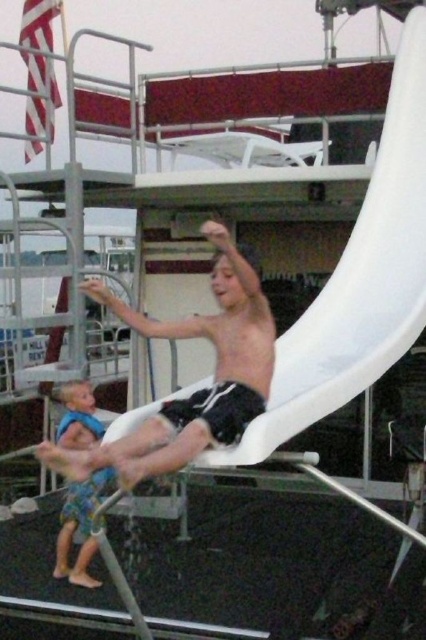
Question: Estimate the real-world distances between objects in this image. Which object is farther from the white plastic slide at center?

Choices:
 (A) smooth white slide at center
 (B) blue fabric swimsuit at lower left

Answer: (B)

Question: Is white plastic slide at center to the left of blue fabric swimsuit at lower left from the viewer's perspective?

Choices:
 (A) no
 (B) yes

Answer: (A)

Question: Is white plastic slide at center below smooth white slide at center?

Choices:
 (A) no
 (B) yes

Answer: (A)

Question: Which object is positioned closest to the smooth white slide at center?

Choices:
 (A) blue fabric swimsuit at lower left
 (B) white plastic slide at center

Answer: (B)

Question: Which of the following is the closest to the observer?

Choices:
 (A) smooth white slide at center
 (B) blue fabric swimsuit at lower left
 (C) white plastic slide at center

Answer: (A)

Question: Does white plastic slide at center come in front of smooth white slide at center?

Choices:
 (A) no
 (B) yes

Answer: (A)